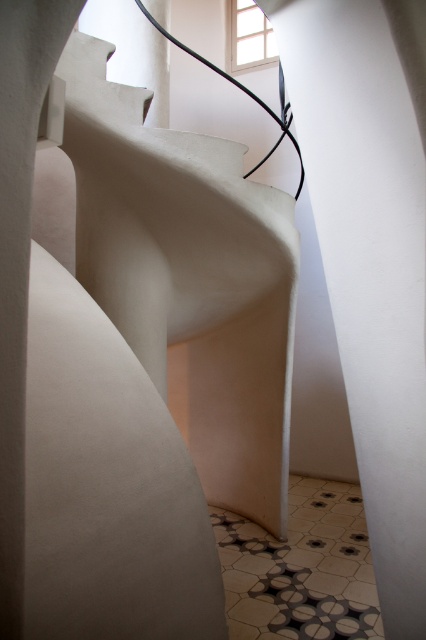
You are standing at the entrance of the spiral staircase and want to reach the point marked at coordinates point (189, 276). Which object in the scene is this point located on?

The point (189, 276) is located on the white matte staircase at center.

You are an interior designer assessing the space for safety. The white matte staircase at center and the white matte wall at center are both part of the design. Which object is taller and requires more attention in terms of structural support?

The white matte staircase at center is taller than the white matte wall at center, so it requires more attention in terms of structural support.